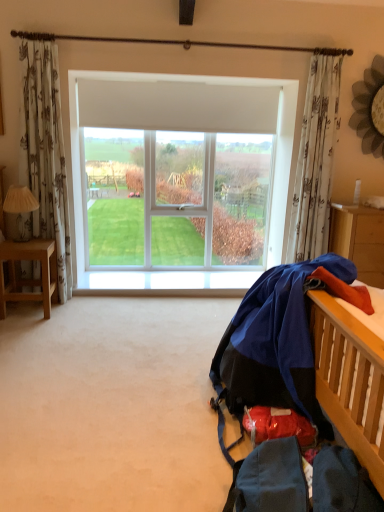
Question: Is white fabric lampshade at left completely or partially outside of light brown wooden desk at left?

Choices:
 (A) no
 (B) yes

Answer: (B)

Question: Is white fabric lampshade at left far from light brown wooden desk at left?

Choices:
 (A) yes
 (B) no

Answer: (B)

Question: Considering the relative positions of white fabric lampshade at left and light brown wooden desk at left in the image provided, is white fabric lampshade at left to the right of light brown wooden desk at left from the viewer's perspective?

Choices:
 (A) no
 (B) yes

Answer: (A)

Question: Considering the relative sizes of white fabric lampshade at left and light brown wooden desk at left in the image provided, is white fabric lampshade at left smaller than light brown wooden desk at left?

Choices:
 (A) no
 (B) yes

Answer: (B)

Question: Is white fabric lampshade at left positioned in front of light brown wooden desk at left?

Choices:
 (A) no
 (B) yes

Answer: (A)

Question: Is white plastic window at center taller or shorter than blue fabric at right?

Choices:
 (A) tall
 (B) short

Answer: (A)

Question: In the image, is white plastic window at center positioned in front of or behind blue fabric at right?

Choices:
 (A) behind
 (B) front

Answer: (A)

Question: From the image's perspective, is white plastic window at center located above or below blue fabric at right?

Choices:
 (A) above
 (B) below

Answer: (A)

Question: Is white plastic window at center inside the boundaries of blue fabric at right, or outside?

Choices:
 (A) inside
 (B) outside

Answer: (B)

Question: From the image's perspective, is white floral fabric curtain at upper right positioned above or below light brown wooden desk at left?

Choices:
 (A) above
 (B) below

Answer: (A)

Question: Considering the positions of white floral fabric curtain at upper right and light brown wooden desk at left in the image, is white floral fabric curtain at upper right taller or shorter than light brown wooden desk at left?

Choices:
 (A) short
 (B) tall

Answer: (B)

Question: Does point click(306, 184) appear closer or farther from the camera than point click(1, 242)?

Choices:
 (A) farther
 (B) closer

Answer: (A)

Question: From a real-world perspective, is white floral fabric curtain at upper right above or below light brown wooden desk at left?

Choices:
 (A) below
 (B) above

Answer: (B)

Question: Based on their sizes in the image, would you say orange fabric at right is bigger or smaller than white floral fabric curtain at upper right?

Choices:
 (A) small
 (B) big

Answer: (B)

Question: Considering the positions of orange fabric at right and white floral fabric curtain at upper right in the image, is orange fabric at right taller or shorter than white floral fabric curtain at upper right?

Choices:
 (A) short
 (B) tall

Answer: (A)